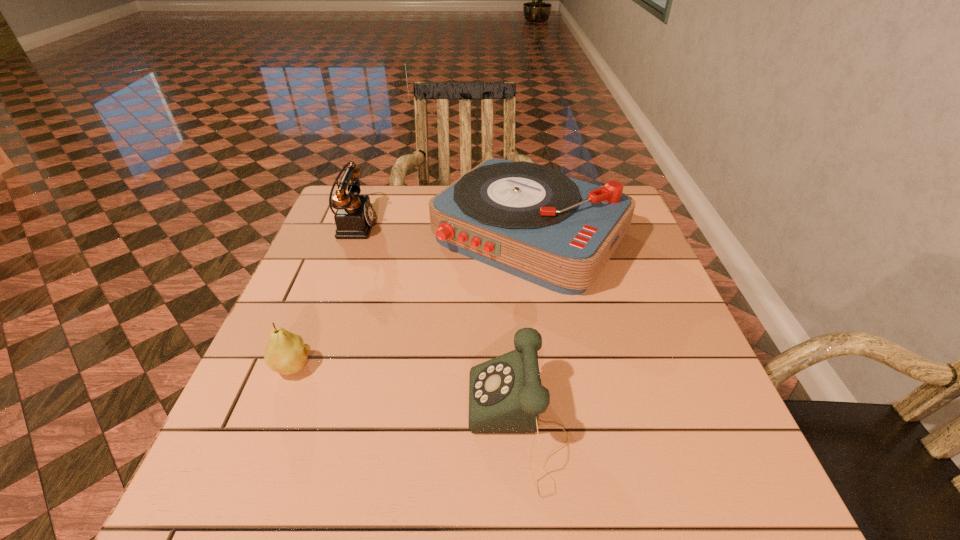
Choose which object is the second nearest neighbor to the taller telephone. Please provide its 2D coordinates. Your answer should be formatted as a tuple, i.e. [(x, y)], where the tuple contains the x and y coordinates of a point satisfying the conditions above.

[(286, 353)]

The width and height of the screenshot is (960, 540). I want to click on the second closest object to the farther telephone, so click(x=286, y=353).

Find the location of `vacant space that satisfies the following two spatial constraints: 1. on the front side of the record player; 2. on the dial of the shorter telephone`. vacant space that satisfies the following two spatial constraints: 1. on the front side of the record player; 2. on the dial of the shorter telephone is located at coordinates (557, 426).

Identify the location of vacant space that satisfies the following two spatial constraints: 1. on the front of the farther telephone at the rotary dial; 2. on the right side of the record player. The width and height of the screenshot is (960, 540). (348, 235).